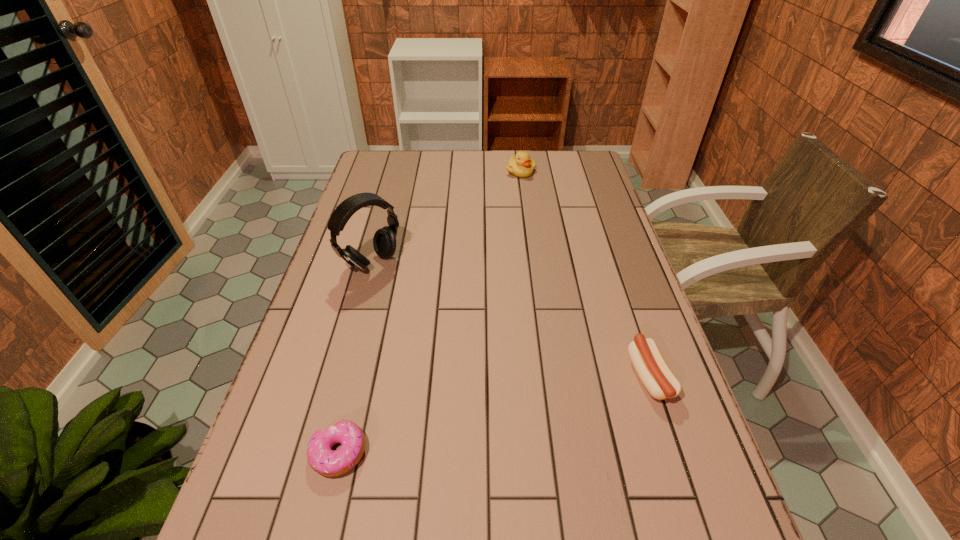
The image size is (960, 540). I want to click on blank space located on the ear cups of the tallest object, so click(427, 309).

Locate an element on the screen. The image size is (960, 540). free space located on the ear cups of the tallest object is located at coordinates (468, 343).

Locate an element on the screen. This screenshot has height=540, width=960. free location located on the ear cups of the tallest object is located at coordinates (420, 303).

Locate an element on the screen. vacant point located on the front-facing side of the second tallest object is located at coordinates (519, 200).

Locate an element on the screen. The width and height of the screenshot is (960, 540). vacant space positioned 0.240m on the front-facing side of the second tallest object is located at coordinates (518, 217).

This screenshot has height=540, width=960. I want to click on free space located 0.260m on the front-facing side of the second tallest object, so click(518, 220).

Locate an element on the screen. The width and height of the screenshot is (960, 540). object situated at the far edge is located at coordinates (520, 165).

Where is `object present at the near edge`? The image size is (960, 540). object present at the near edge is located at coordinates (322, 459).

Image resolution: width=960 pixels, height=540 pixels. In order to click on doughnut positioned at the left edge in this screenshot , I will do `click(322, 459)`.

Where is `earphone that is at the left edge`? Image resolution: width=960 pixels, height=540 pixels. earphone that is at the left edge is located at coordinates (384, 241).